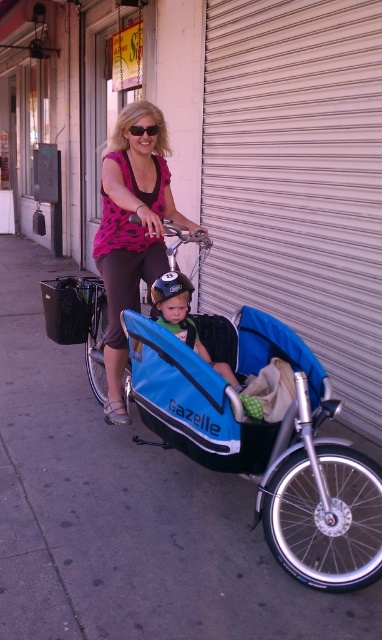
Locate an element on the screen. This screenshot has height=640, width=382. blue fabric baby carriage at center is located at coordinates (265, 444).

Locate an element on the screen. This screenshot has height=640, width=382. blue fabric baby carriage at center is located at coordinates (265, 444).

Does blue fabric baby carriage at center have a greater width compared to black plastic sunglasses at upper center?

Yes, blue fabric baby carriage at center is wider than black plastic sunglasses at upper center.

Find the location of a particular element. The image size is (382, 640). blue fabric baby carriage at center is located at coordinates (265, 444).

Can you confirm if gray concrete sidewalk at center is thinner than matte pink shirt at center?

Incorrect, gray concrete sidewalk at center's width is not less than matte pink shirt at center's.

Who is shorter, gray concrete sidewalk at center or matte pink shirt at center?

gray concrete sidewalk at center is shorter.

Is point (155, 584) behind point (103, 192)?

No, (155, 584) is in front of (103, 192).

Identify the location of gray concrete sidewalk at center. (124, 513).